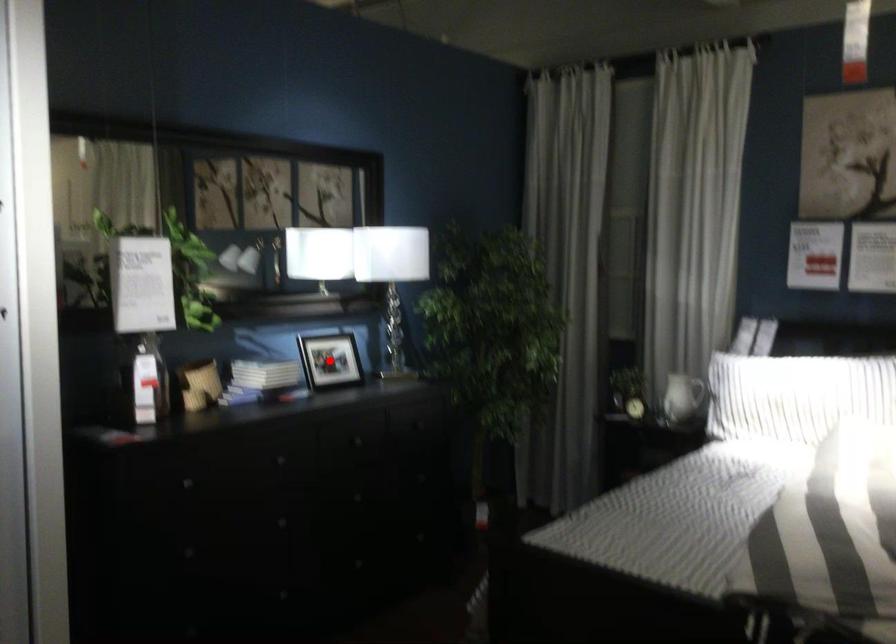
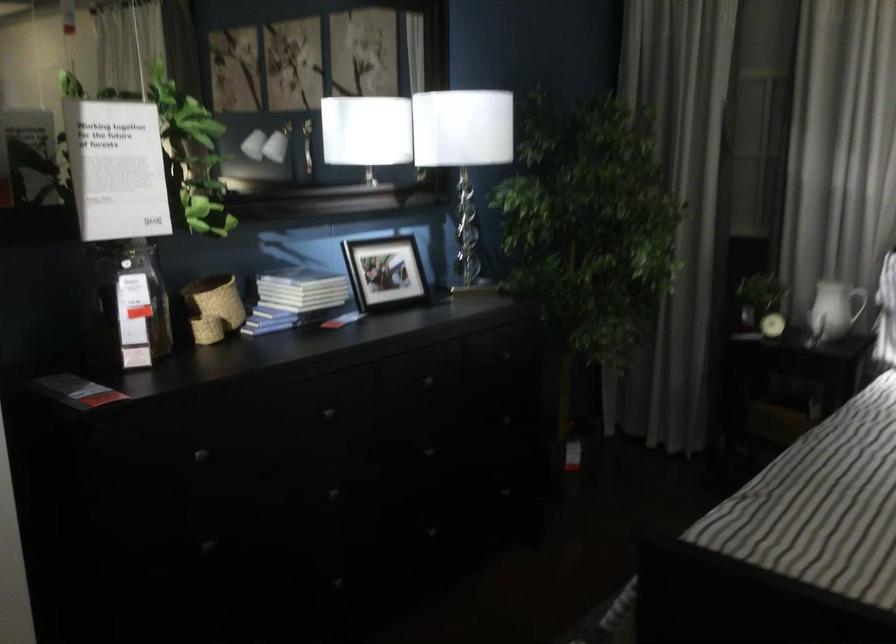
Question: I am providing you with two images of the same scene from different viewpoints. A red point is shown in image1. For the corresponding object point in image2, is it positioned nearer or farther from the camera?

Choices:
 (A) Nearer
 (B) Farther

Answer: (A)